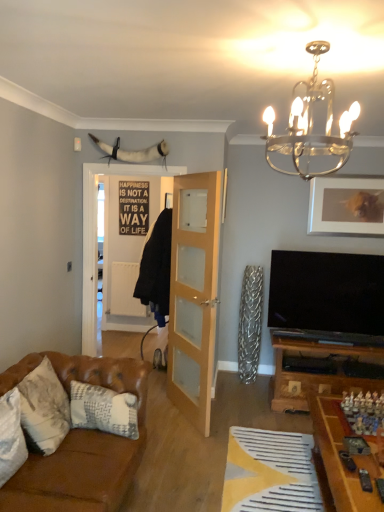
Locate an element on the screen. This screenshot has width=384, height=512. free space to the left of clear glass door at center is located at coordinates (165, 413).